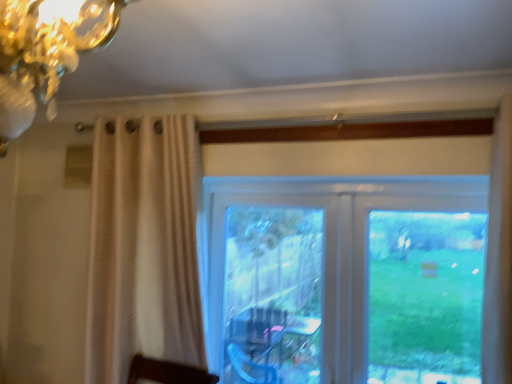
The image size is (512, 384). What do you see at coordinates (266, 288) in the screenshot?
I see `transparent glass screen door at center` at bounding box center [266, 288].

In order to face transparent glass screen door at center, should I rotate leftwards or rightwards?

Turn right by 1.607 degrees to look at transparent glass screen door at center.

Identify the location of transparent glass screen door at center. (266, 288).

Describe the element at coordinates (349, 275) in the screenshot. I see `transparent glass window at center` at that location.

At what (x,y) coordinates should I click in order to perform the action: click on transparent glass window at center. Please return your answer as a coordinate pair (x, y). The width and height of the screenshot is (512, 384). Looking at the image, I should click on (349, 275).

This screenshot has height=384, width=512. I want to click on transparent glass screen door at center, so click(x=266, y=288).

Is transparent glass screen door at center at the right side of transparent glass window at center?

No.

Which object is more forward, transparent glass screen door at center or transparent glass window at center?

Positioned in front is transparent glass window at center.

Considering the points (226, 363) and (238, 368), which point is in front, point (226, 363) or point (238, 368)?

The point (226, 363) is closer.

From the image's perspective, relative to transparent glass window at center, is transparent glass screen door at center above or below?

From the image's perspective, transparent glass screen door at center appears below transparent glass window at center.

From a real-world perspective, is transparent glass screen door at center above or below transparent glass window at center?

transparent glass screen door at center is below transparent glass window at center.

Does transparent glass screen door at center have a lesser width compared to transparent glass window at center?

Yes, transparent glass screen door at center is thinner than transparent glass window at center.

Considering the relative sizes of transparent glass screen door at center and transparent glass window at center in the image provided, is transparent glass screen door at center taller than transparent glass window at center?

No.

Does transparent glass screen door at center have a larger size compared to transparent glass window at center?

No.

Could transparent glass window at center be considered to be inside transparent glass screen door at center?

Yes, transparent glass window at center is surrounded by transparent glass screen door at center.

Is transparent glass screen door at center positioned far away from transparent glass window at center?

transparent glass screen door at center is near transparent glass window at center, not far away.

Is transparent glass screen door at center oriented towards transparent glass window at center?

Yes, transparent glass screen door at center is turned towards transparent glass window at center.

In the scene shown: What's the angular difference between transparent glass screen door at center and transparent glass window at center's facing directions?

There is a 0.396-degree angle between the facing directions of transparent glass screen door at center and transparent glass window at center.

This screenshot has height=384, width=512. Find the location of `screen door lying below the transparent glass window at center (from the image's perspective)`. screen door lying below the transparent glass window at center (from the image's perspective) is located at coordinates (266, 288).

Consider the image. Considering the relative positions of transparent glass window at center and transparent glass screen door at center in the image provided, is transparent glass window at center to the right of transparent glass screen door at center from the viewer's perspective?

Indeed, transparent glass window at center is positioned on the right side of transparent glass screen door at center.

Between transparent glass window at center and transparent glass screen door at center, which one is positioned behind?

transparent glass screen door at center is behind.

Which is nearer, (336, 373) or (226, 298)?

Point (336, 373) is closer to the camera than point (226, 298).

From the image's perspective, relative to transparent glass screen door at center, is transparent glass window at center above or below?

From the image's perspective, transparent glass window at center appears above transparent glass screen door at center.

From a real-world perspective, is transparent glass window at center positioned above or below transparent glass screen door at center?

Clearly, from a real-world perspective, transparent glass window at center is above transparent glass screen door at center.

Between transparent glass window at center and transparent glass screen door at center, which one has larger width?

transparent glass window at center.

Considering the relative sizes of transparent glass window at center and transparent glass screen door at center in the image provided, is transparent glass window at center shorter than transparent glass screen door at center?

Incorrect, the height of transparent glass window at center does not fall short of that of transparent glass screen door at center.

Can you confirm if transparent glass window at center is bigger than transparent glass screen door at center?

Yes.

Is transparent glass screen door at center located within transparent glass window at center?

Yes, transparent glass screen door at center is a part of transparent glass window at center.

Does transparent glass window at center touch transparent glass screen door at center?

No, transparent glass window at center is not beside transparent glass screen door at center.

Looking at this image, does transparent glass window at center turn towards transparent glass screen door at center?

Yes, transparent glass window at center is oriented towards transparent glass screen door at center.

How many degrees apart are the facing directions of transparent glass window at center and transparent glass screen door at center?

0.396 degrees separate the facing orientations of transparent glass window at center and transparent glass screen door at center.

This screenshot has height=384, width=512. Find the location of `window above the transparent glass screen door at center (from a real-world perspective)`. window above the transparent glass screen door at center (from a real-world perspective) is located at coordinates (349, 275).

This screenshot has height=384, width=512. In order to click on window above the transparent glass screen door at center (from a real-world perspective) in this screenshot , I will do `click(349, 275)`.

You are a GUI agent. You are given a task and a screenshot of the screen. Output one action in this format:
    pyautogui.click(x=<x>, y=<y>)
    Task: Click on the screen door behind the transparent glass window at center
    The height and width of the screenshot is (384, 512).
    Given the screenshot: What is the action you would take?
    pyautogui.click(x=266, y=288)